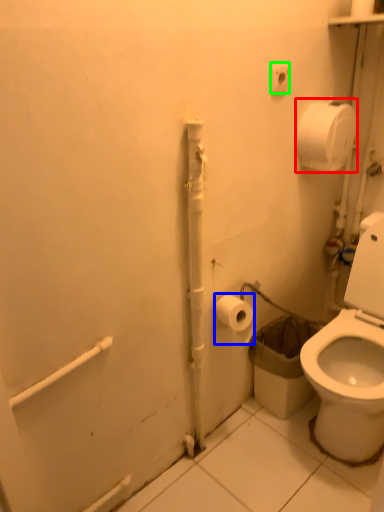
Question: Which object is the farthest from toilet paper (highlighted by a red box)? Choose among these: toilet paper (highlighted by a blue box) or electric outlet (highlighted by a green box).

Choices:
 (A) toilet paper
 (B) electric outlet

Answer: (A)